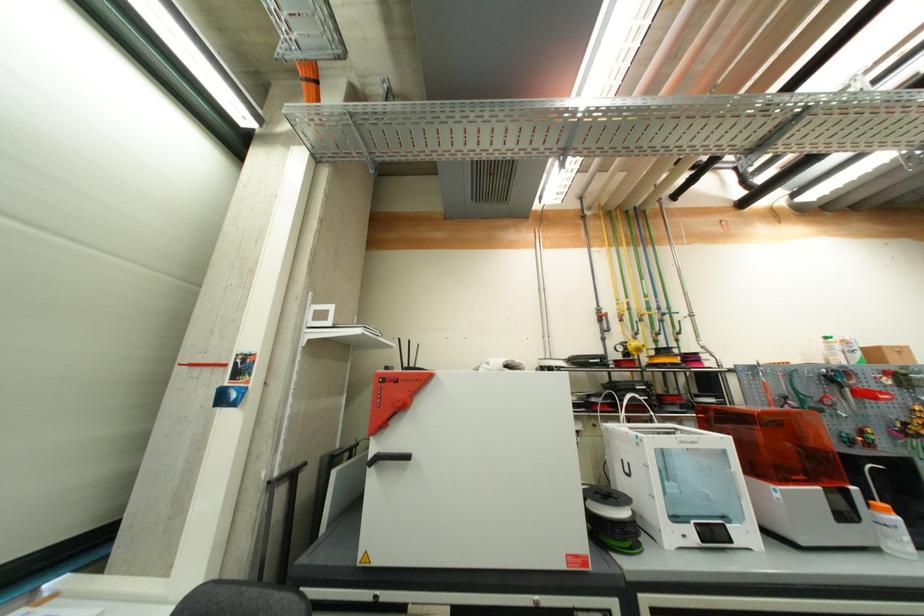
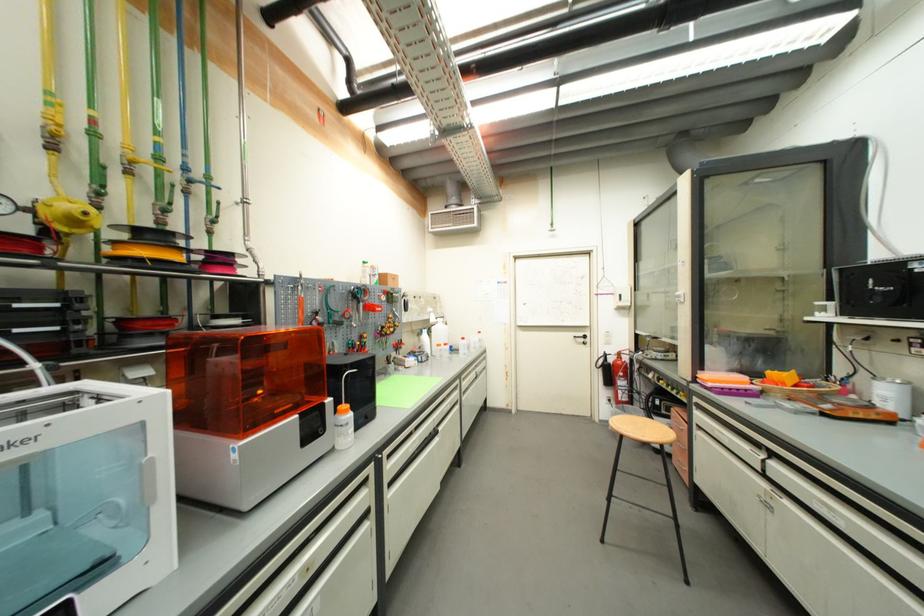
Locate, in the second image, the point that corresponds to point (794, 373) in the first image.

(334, 289)